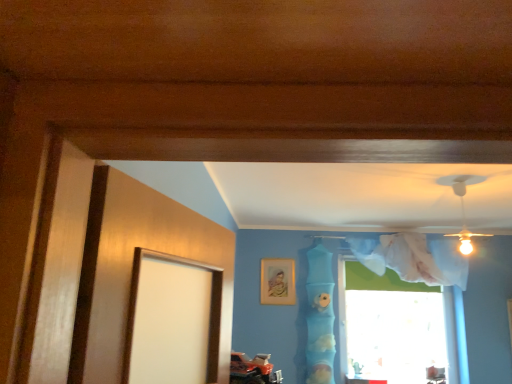
Question: From a real-world perspective, does gold metallic picture frame at upper center stand above blue fabric at center?

Choices:
 (A) yes
 (B) no

Answer: (A)

Question: Is gold metallic picture frame at upper center outside blue fabric at center?

Choices:
 (A) no
 (B) yes

Answer: (B)

Question: Does gold metallic picture frame at upper center have a lesser width compared to blue fabric at center?

Choices:
 (A) no
 (B) yes

Answer: (B)

Question: Is gold metallic picture frame at upper center bigger than blue fabric at center?

Choices:
 (A) no
 (B) yes

Answer: (A)

Question: Is gold metallic picture frame at upper center taller than blue fabric at center?

Choices:
 (A) no
 (B) yes

Answer: (A)

Question: Does gold metallic picture frame at upper center turn towards blue fabric at center?

Choices:
 (A) no
 (B) yes

Answer: (A)

Question: Is blue fabric at center shorter than gold metallic picture frame at upper center?

Choices:
 (A) no
 (B) yes

Answer: (A)

Question: Considering the relative sizes of blue fabric at center and gold metallic picture frame at upper center in the image provided, is blue fabric at center bigger than gold metallic picture frame at upper center?

Choices:
 (A) yes
 (B) no

Answer: (A)

Question: From a real-world perspective, is blue fabric at center below gold metallic picture frame at upper center?

Choices:
 (A) yes
 (B) no

Answer: (A)

Question: Considering the relative positions of blue fabric at center and gold metallic picture frame at upper center in the image provided, is blue fabric at center to the left of gold metallic picture frame at upper center from the viewer's perspective?

Choices:
 (A) yes
 (B) no

Answer: (B)

Question: Is blue fabric at center looking in the opposite direction of gold metallic picture frame at upper center?

Choices:
 (A) no
 (B) yes

Answer: (A)

Question: Is blue fabric at center oriented towards gold metallic picture frame at upper center?

Choices:
 (A) yes
 (B) no

Answer: (B)

Question: Does transparent fabric at upper right turn towards blue fabric at center?

Choices:
 (A) yes
 (B) no

Answer: (B)